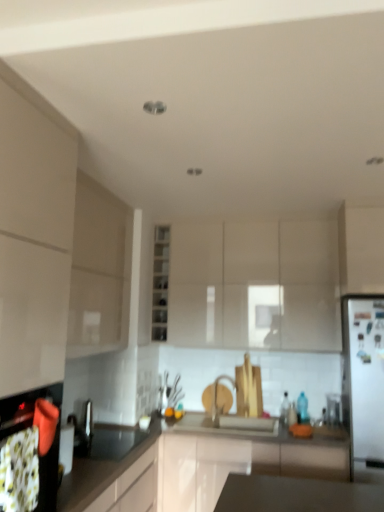
Question: From a real-world perspective, is black glossy countertop at lower left physically below white glossy refrigerator at right?

Choices:
 (A) yes
 (B) no

Answer: (A)

Question: Considering the relative sizes of black glossy countertop at lower left and white glossy refrigerator at right in the image provided, is black glossy countertop at lower left smaller than white glossy refrigerator at right?

Choices:
 (A) no
 (B) yes

Answer: (A)

Question: Considering the relative sizes of black glossy countertop at lower left and white glossy refrigerator at right in the image provided, is black glossy countertop at lower left bigger than white glossy refrigerator at right?

Choices:
 (A) yes
 (B) no

Answer: (A)

Question: Considering the relative positions of black glossy countertop at lower left and white glossy refrigerator at right in the image provided, is black glossy countertop at lower left to the left of white glossy refrigerator at right from the viewer's perspective?

Choices:
 (A) no
 (B) yes

Answer: (B)

Question: Is black glossy countertop at lower left surrounding white glossy refrigerator at right?

Choices:
 (A) no
 (B) yes

Answer: (A)

Question: Is black glossy countertop at lower left beside white glossy refrigerator at right?

Choices:
 (A) yes
 (B) no

Answer: (B)

Question: Would you say matte beige cabinet at left, which appears as the 2th cabinetry when viewed from the left, is part of matte white cabinet at center, the 4th cabinetry when ordered from left to right,'s contents?

Choices:
 (A) no
 (B) yes

Answer: (A)

Question: From the image's perspective, is matte white cabinet at center, marked as the 2th cabinetry in a right-to-left arrangement, beneath matte beige cabinet at left, which appears as the 2th cabinetry when viewed from the left?

Choices:
 (A) yes
 (B) no

Answer: (A)

Question: Does matte white cabinet at center, marked as the 2th cabinetry in a right-to-left arrangement, have a smaller size compared to matte beige cabinet at left, which appears as the 2th cabinetry when viewed from the left?

Choices:
 (A) no
 (B) yes

Answer: (A)

Question: Is matte white cabinet at center, the 4th cabinetry when ordered from left to right, taller than matte beige cabinet at left, arranged as the fourth cabinetry when viewed from the right?

Choices:
 (A) no
 (B) yes

Answer: (A)

Question: Can you confirm if matte white cabinet at center, marked as the 2th cabinetry in a right-to-left arrangement, is wider than matte beige cabinet at left, which appears as the 2th cabinetry when viewed from the left?

Choices:
 (A) yes
 (B) no

Answer: (A)

Question: Is matte white cabinet at center, the 4th cabinetry when ordered from left to right, facing away from matte beige cabinet at left, which appears as the 2th cabinetry when viewed from the left?

Choices:
 (A) no
 (B) yes

Answer: (A)

Question: Is white glossy cabinet at right, which is the first cabinetry in right-to-left order, not inside matte white cabinet at center, marked as the 2th cabinetry in a right-to-left arrangement?

Choices:
 (A) no
 (B) yes

Answer: (B)